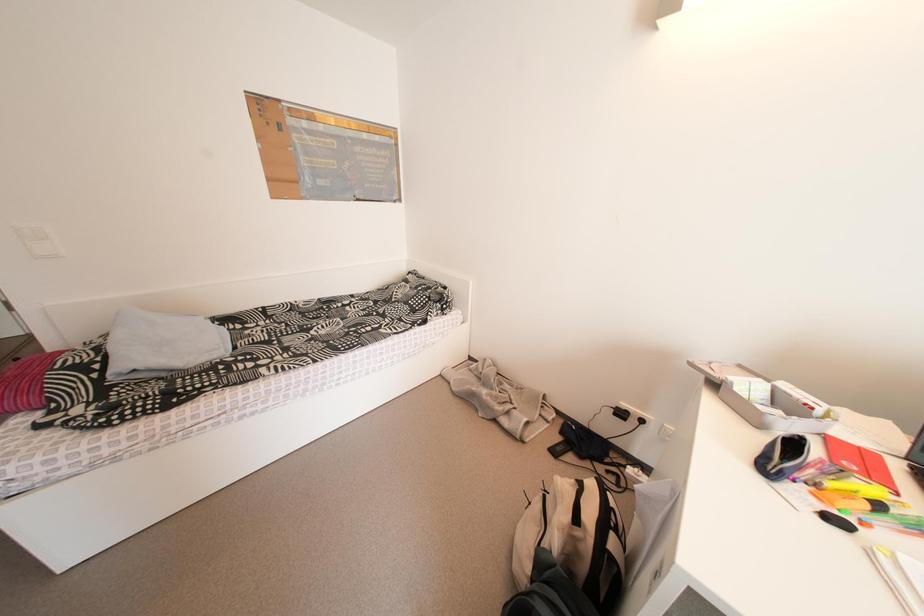
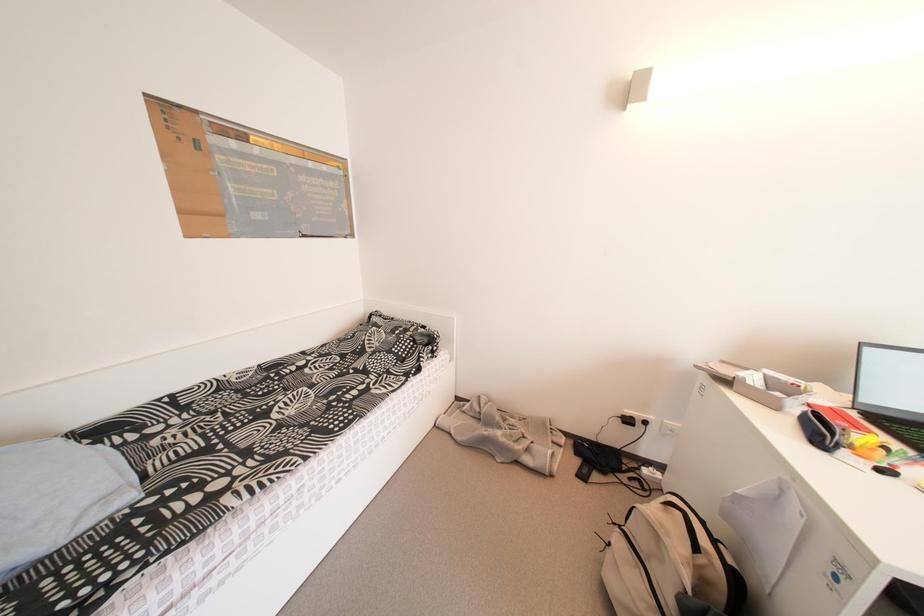
What movement of the cameraman would produce the second image?

The cameraman moved toward left, forward.